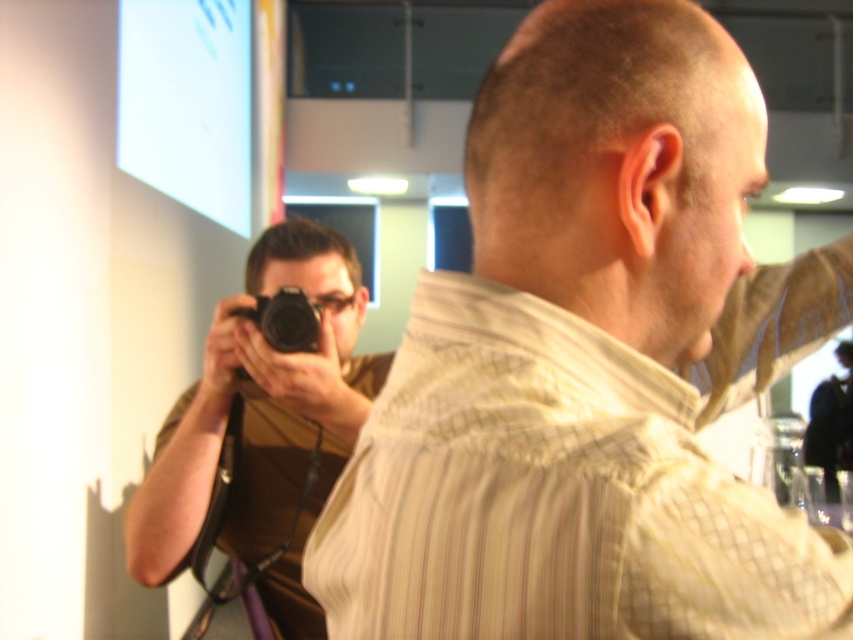
Question: Which point is closer to the camera?

Choices:
 (A) (291, 308)
 (B) (647, 212)
 (C) (268, 416)

Answer: (B)

Question: Does light beige striped shirt at center have a lesser width compared to black plastic camera at center?

Choices:
 (A) no
 (B) yes

Answer: (A)

Question: Which object is the farthest from the light beige striped shirt at center?

Choices:
 (A) black matte camera at center
 (B) black plastic camera at center

Answer: (B)

Question: Does black matte camera at center appear on the left side of black plastic camera at center?

Choices:
 (A) no
 (B) yes

Answer: (B)

Question: Which point is farther to the camera?

Choices:
 (A) (317, 412)
 (B) (318, 323)

Answer: (B)

Question: Can you confirm if light beige striped shirt at center is positioned below black plastic camera at center?

Choices:
 (A) no
 (B) yes

Answer: (A)